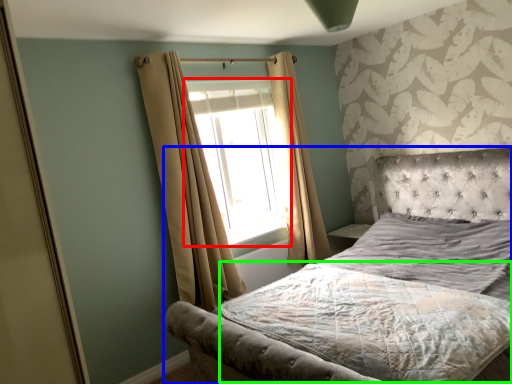
Question: Which object is the farthest from window (highlighted by a red box)? Choose among these: bed (highlighted by a blue box) or mattress (highlighted by a green box).

Choices:
 (A) bed
 (B) mattress

Answer: (B)